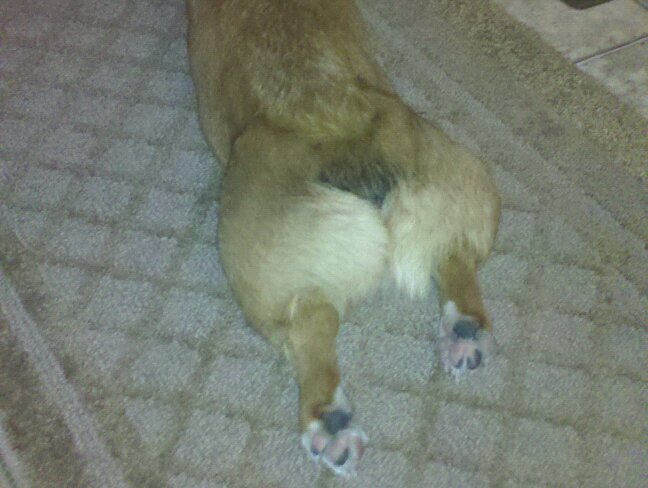
Locate an element on the screen. The height and width of the screenshot is (488, 648). floor runner carpet is located at coordinates (564, 287).